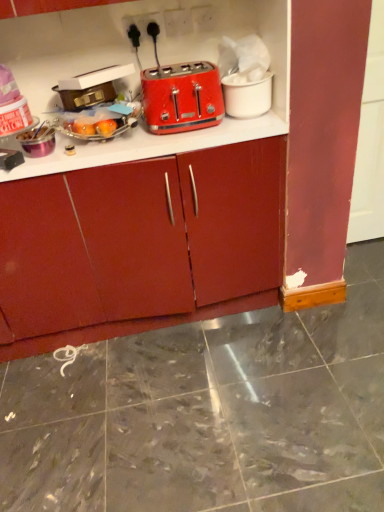
The image size is (384, 512). Find the location of `free space above metallic gold suitcase at upper left, the first appliance positioned from the left (from a real-world perspective)`. free space above metallic gold suitcase at upper left, the first appliance positioned from the left (from a real-world perspective) is located at coordinates (77, 87).